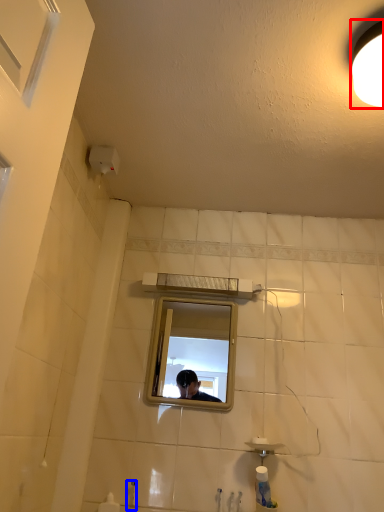
Question: Which object is further to the camera taking this photo, light fixture (highlighted by a red box) or faucet (highlighted by a blue box)?

Choices:
 (A) light fixture
 (B) faucet

Answer: (B)